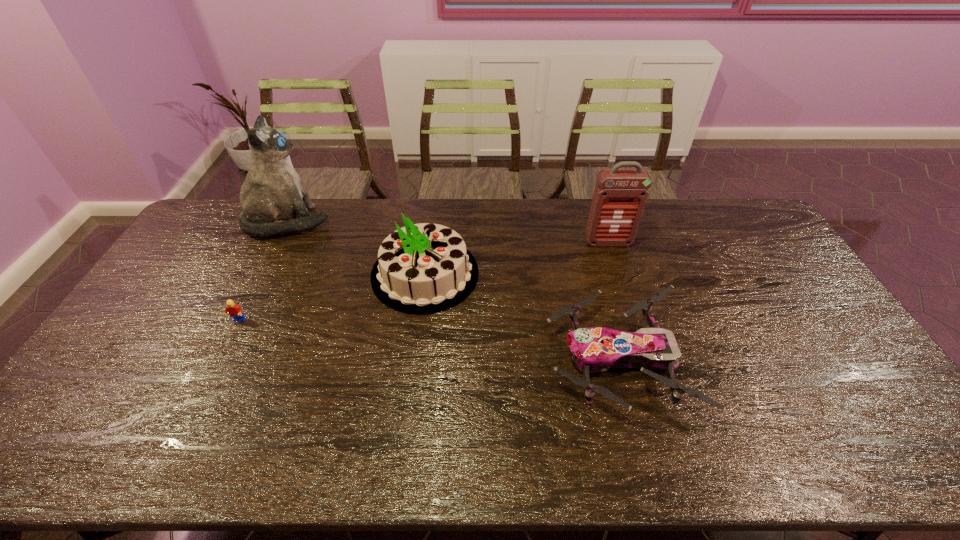
The height and width of the screenshot is (540, 960). I want to click on cat, so click(x=273, y=194).

The height and width of the screenshot is (540, 960). Identify the location of the first-aid kit. (620, 195).

You are a GUI agent. You are given a task and a screenshot of the screen. Output one action in this format:
    pyautogui.click(x=<x>, y=<y>)
    Task: Click on the third object from left to right
    The height and width of the screenshot is (540, 960).
    Given the screenshot: What is the action you would take?
    pyautogui.click(x=425, y=268)

I want to click on birthday cake, so click(x=425, y=268).

At what (x,y) coordinates should I click in order to perform the action: click on drone. Please return your answer as a coordinate pair (x, y). Looking at the image, I should click on (596, 349).

At what (x,y) coordinates should I click in order to perform the action: click on Lego. Please return your answer as a coordinate pair (x, y). Looking at the image, I should click on (234, 310).

At what (x,y) coordinates should I click in order to perform the action: click on vacant space located 0.290m at the face of the cat. Please return your answer as a coordinate pair (x, y). This screenshot has height=540, width=960. Looking at the image, I should click on (409, 222).

At what (x,y) coordinates should I click in order to perform the action: click on free region located on the front-facing side of the second tallest object. Please return your answer as a coordinate pair (x, y). This screenshot has height=540, width=960. Looking at the image, I should click on (617, 272).

The height and width of the screenshot is (540, 960). I want to click on blank area located on the left of the third shortest object, so click(345, 274).

Identify the location of free space located on the front-facing side of the drone. (452, 360).